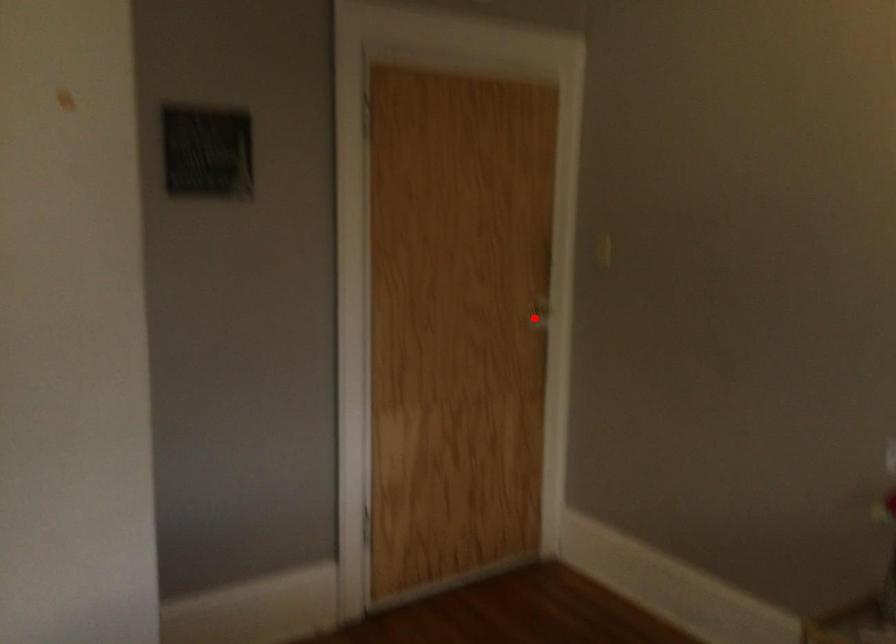
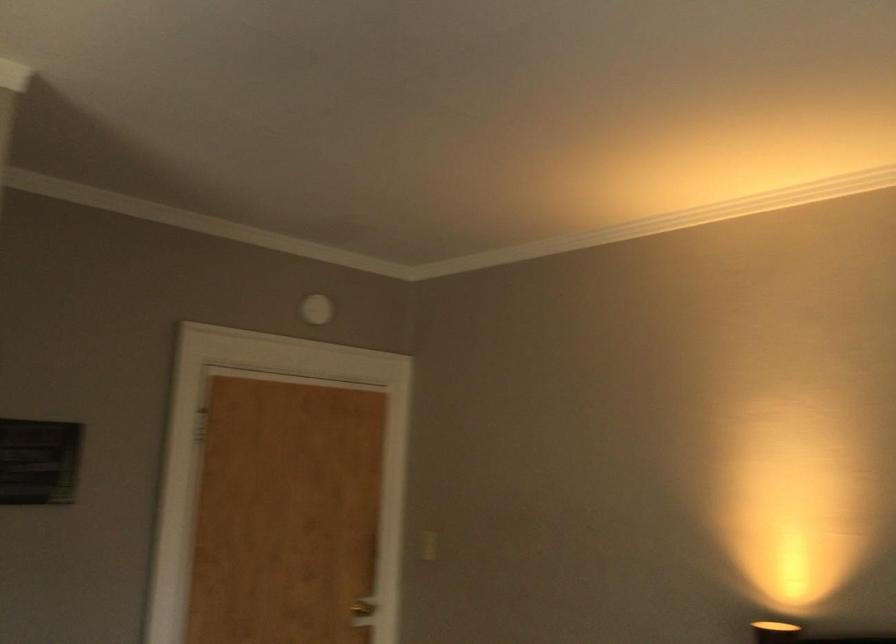
Question: I am providing you with two images of the same scene from different viewpoints. A red point is marked on the first image. At the location where the point appears in image 1, is it still visible in image 2?

Choices:
 (A) Yes
 (B) No

Answer: (A)